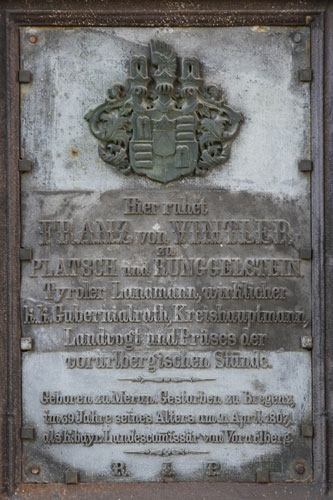
The image size is (333, 500). What are the coordinates of `ornament` in the screenshot? It's located at (167, 454).